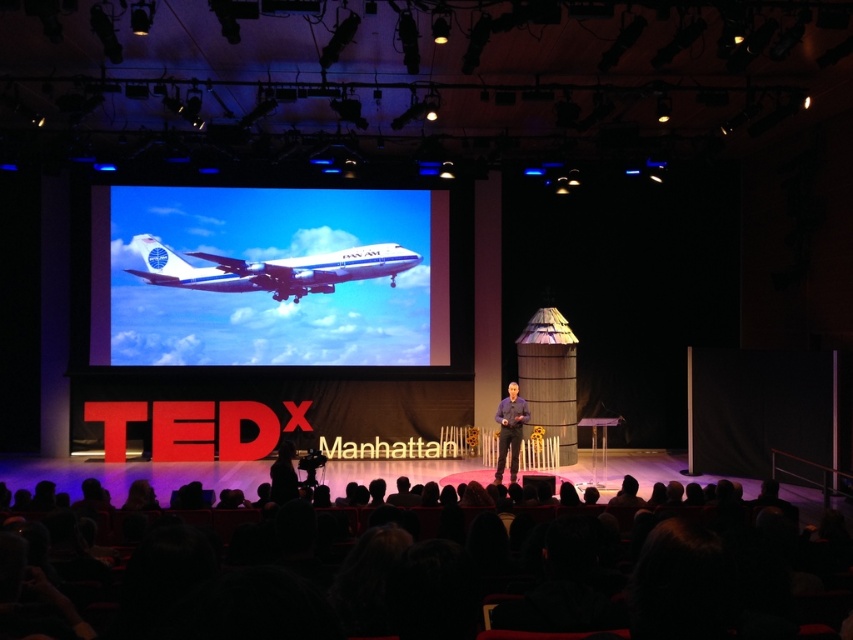
Based on the photo, is white glossy airplane at center in front of silky black hair at lower center?

That is False.

Is white glossy airplane at center positioned behind silky black hair at lower center?

That is True.

Does point (247, 268) come farther from viewer compared to point (48, 472)?

Yes.

You are a GUI agent. You are given a task and a screenshot of the screen. Output one action in this format:
    pyautogui.click(x=<x>, y=<y>)
    Task: Click on the white glossy airplane at center
    
    Given the screenshot: What is the action you would take?
    pyautogui.click(x=271, y=269)

Does white glossy airplane at center have a larger size compared to dark blue shirt at lower center?

Yes.

Which of these two, white glossy airplane at center or dark blue shirt at lower center, stands taller?

white glossy airplane at center is taller.

This screenshot has height=640, width=853. What do you see at coordinates (271, 269) in the screenshot?
I see `white glossy airplane at center` at bounding box center [271, 269].

The height and width of the screenshot is (640, 853). In order to click on white glossy airplane at center in this screenshot , I will do `click(271, 269)`.

Is point (376, 358) positioned after point (824, 595)?

Yes, it is.

Which is more to the left, white glossy airplane at upper center or silky black hair at lower center?

From the viewer's perspective, white glossy airplane at upper center appears more on the left side.

Who is more forward, (367,284) or (680,627)?

Point (680,627) is in front.

Image resolution: width=853 pixels, height=640 pixels. I want to click on white glossy airplane at upper center, so click(270, 276).